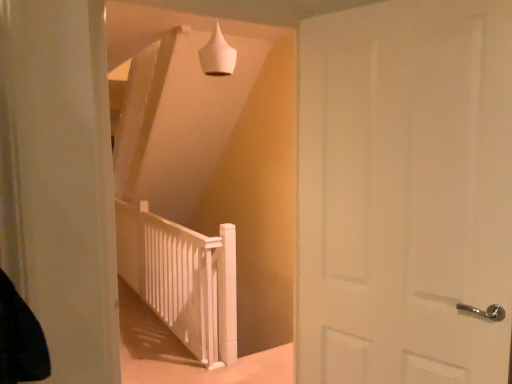
Question: Is white matte door at center in front of white matte cone at upper center?

Choices:
 (A) yes
 (B) no

Answer: (A)

Question: Does white matte door at center touch white matte cone at upper center?

Choices:
 (A) yes
 (B) no

Answer: (B)

Question: Considering the relative positions of white matte door at center and white matte cone at upper center in the image provided, is white matte door at center behind white matte cone at upper center?

Choices:
 (A) yes
 (B) no

Answer: (B)

Question: Can you confirm if white matte door at center is wider than white matte cone at upper center?

Choices:
 (A) no
 (B) yes

Answer: (A)

Question: Does white matte door at center turn towards white matte cone at upper center?

Choices:
 (A) yes
 (B) no

Answer: (B)

Question: From a real-world perspective, is white matte door at center above or below white matte cone at upper center?

Choices:
 (A) above
 (B) below

Answer: (B)

Question: Based on their sizes in the image, would you say white matte door at center is bigger or smaller than white matte cone at upper center?

Choices:
 (A) big
 (B) small

Answer: (A)

Question: Relative to white matte cone at upper center, is white matte door at center in front or behind?

Choices:
 (A) behind
 (B) front

Answer: (B)

Question: From the image's perspective, is white matte door at center located above or below white matte cone at upper center?

Choices:
 (A) below
 (B) above

Answer: (A)

Question: Would you say white matte cone at upper center is to the left or to the right of white matte door at center in the picture?

Choices:
 (A) left
 (B) right

Answer: (A)

Question: From the image's perspective, relative to white matte door at center, is white matte cone at upper center above or below?

Choices:
 (A) below
 (B) above

Answer: (B)

Question: Does point (220, 61) appear closer or farther from the camera than point (315, 221)?

Choices:
 (A) closer
 (B) farther

Answer: (B)

Question: Is white matte cone at upper center situated inside white matte door at center or outside?

Choices:
 (A) outside
 (B) inside

Answer: (A)

Question: In terms of size, does white matte door at center appear bigger or smaller than white matte rail at center?

Choices:
 (A) big
 (B) small

Answer: (B)

Question: Looking at their shapes, would you say white matte door at center is wider or thinner than white matte rail at center?

Choices:
 (A) wide
 (B) thin

Answer: (B)